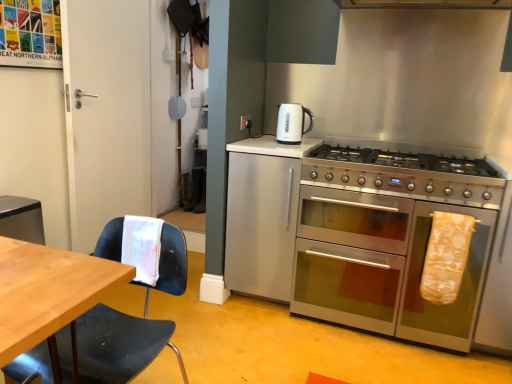
The width and height of the screenshot is (512, 384). In order to click on vacant area that is in front of stainless steel oven at right in this screenshot , I will do `click(381, 355)`.